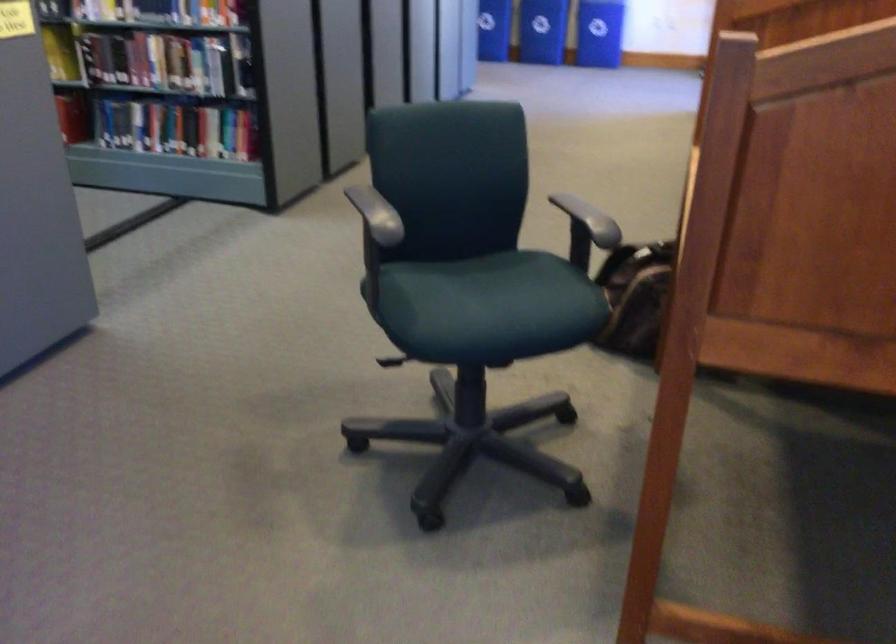
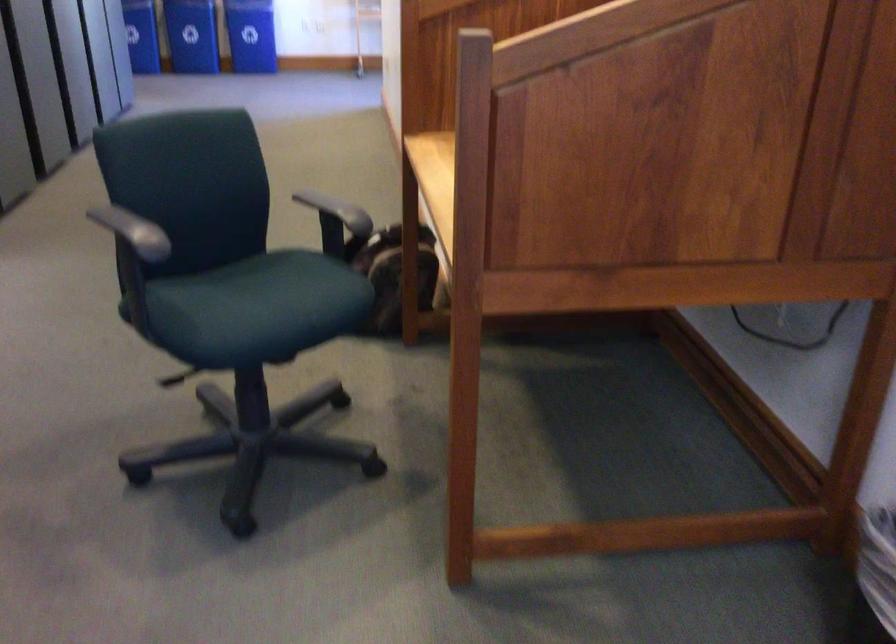
Question: The camera is either moving clockwise (left) or counter-clockwise (right) around the object. The first image is from the beginning of the video and the second image is from the end. Is the camera moving left or right when shooting the video?

Choices:
 (A) Left
 (B) Right

Answer: (A)